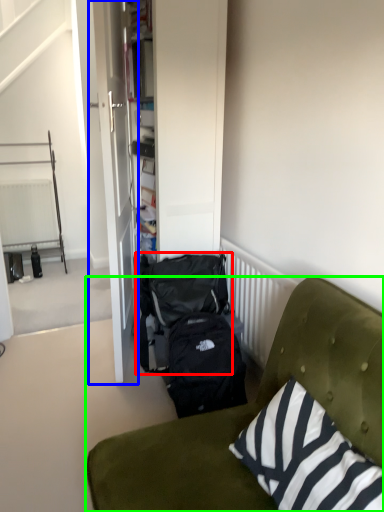
Question: Considering the real-world distances, which object is farthest from backpack (highlighted by a red box)? door (highlighted by a blue box) or studio couch (highlighted by a green box)?

Choices:
 (A) door
 (B) studio couch

Answer: (B)